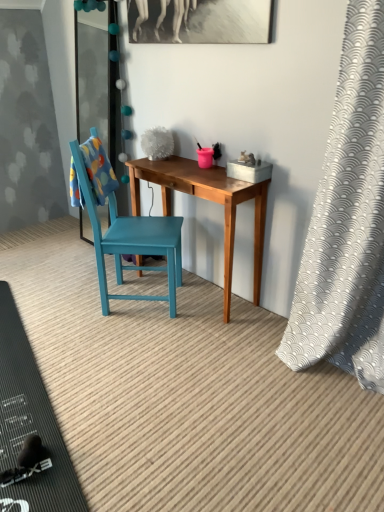
Where is `free space to the left of wooden desk at center`? free space to the left of wooden desk at center is located at coordinates (79, 307).